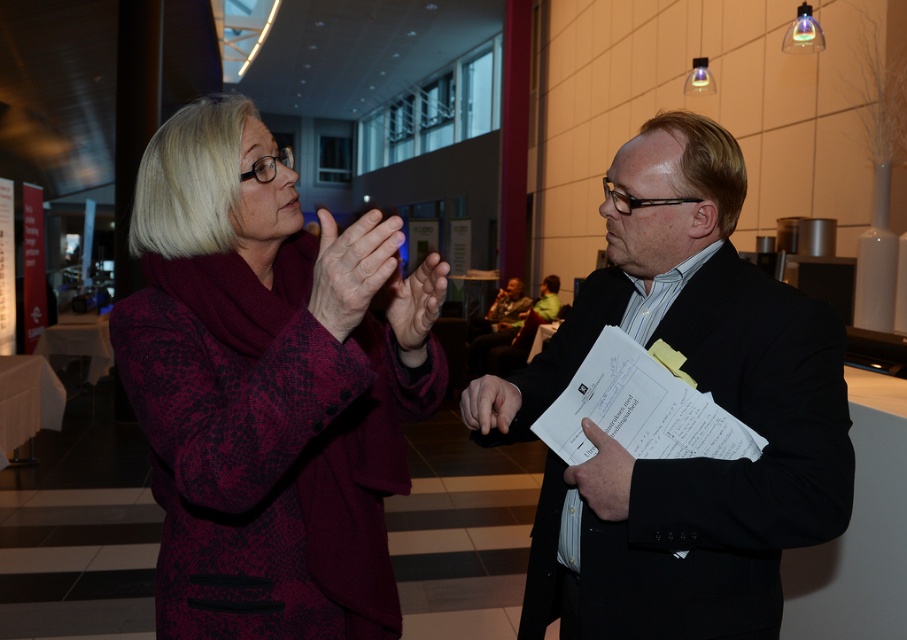
Question: Can you confirm if maroon textured coat at center is positioned below black matte suit at center?

Choices:
 (A) yes
 (B) no

Answer: (B)

Question: Among these points, which one is farthest from the camera?

Choices:
 (A) (782, 499)
 (B) (278, 490)

Answer: (B)

Question: Does maroon textured coat at center lie in front of black matte suit at center?

Choices:
 (A) yes
 (B) no

Answer: (A)

Question: Can you confirm if maroon textured coat at center is positioned to the right of black matte suit at center?

Choices:
 (A) no
 (B) yes

Answer: (A)

Question: Which object is farther from the camera taking this photo?

Choices:
 (A) black matte suit at center
 (B) maroon textured coat at center

Answer: (A)